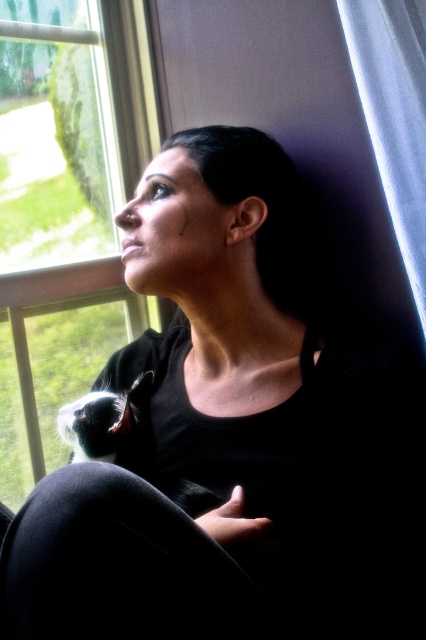
You are a painter standing in the room and want to capture the view outside the transparent glass window at upper left. However, you notice the white sheer curtain at upper right is blocking your view. Can you move the curtain to get a clear view?

The white sheer curtain at upper right is behind the transparent glass window at upper left, so it cannot block the view. Therefore, you don not need to move the curtain to see outside the window.

What is located at the coordinate point (x=66, y=211) in the image?

The transparent glass window at upper left is located at point (x=66, y=211).